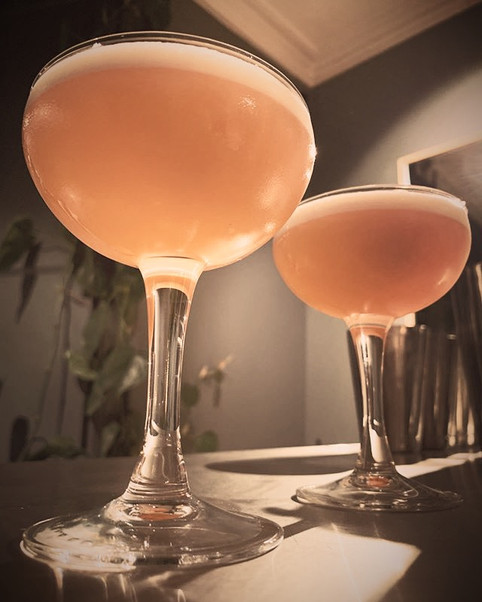
Where is `green plant`? This screenshot has width=482, height=602. green plant is located at coordinates (115, 314).